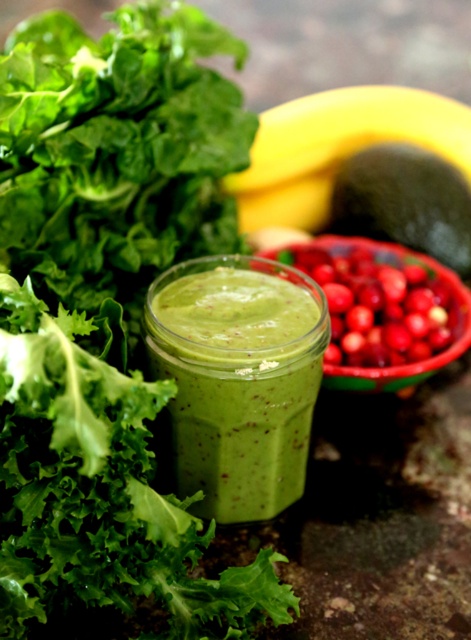
You are a nutritionist analyzing the image. The green matte smoothie at center and the shiny red berries at center are both present. Which of these two items has a larger diameter?

The shiny red berries at center have a larger diameter than the green matte smoothie at center, as the description states that the green matte smoothie at center is thinner.

You are a nutritionist analyzing the image. You need to determine which of the two items, the green matte smoothie at center or the shiny red berries at center, is smaller in size. Based on the scene, which one is smaller?

The green matte smoothie at center is smaller in size compared to the shiny red berries at center.

You are a nutritionist who needs to place a measuring tape between the yellow matte banana at upper center and the shiny red berries at center. How far apart are they?

The distance between the yellow matte banana at upper center and the shiny red berries at center is 9.09 centimeters.